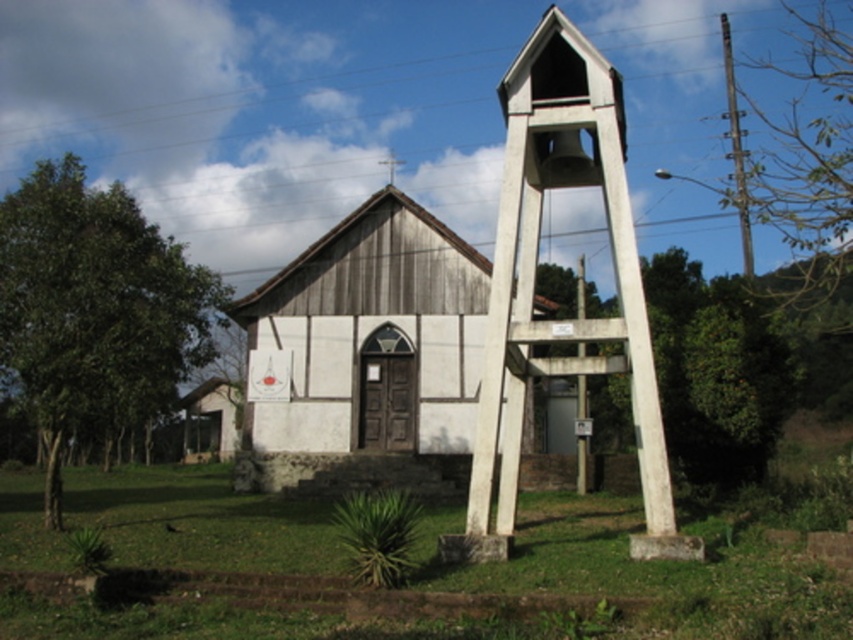
You are standing in front of the church and bell tower. There are two points marked on the image at coordinates point (294, 481) and point (521, 99). Which point is closer to you?

Point (294, 481) is further to the camera than point (521, 99), so the point closer to you is point (521, 99).

You are a maintenance worker needing to inspect both the wooden church at center and the white concrete bell tower at center. The path between them is 6.74 meters. If your ladder is 6 meters long, can you safely carry it horizontally from one to the other without it touching the ground?

The distance between the wooden church at center and the white concrete bell tower at center is 6.74 meters. Since the ladder is only 6 meters long, it would not reach across the gap. Therefore, you cannot safely carry it horizontally without it touching the ground.